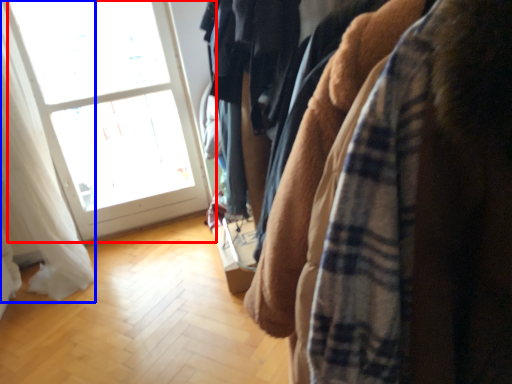
Question: Which object appears closest to the camera in this image, window (highlighted by a red box) or curtain (highlighted by a blue box)?

Choices:
 (A) window
 (B) curtain

Answer: (B)